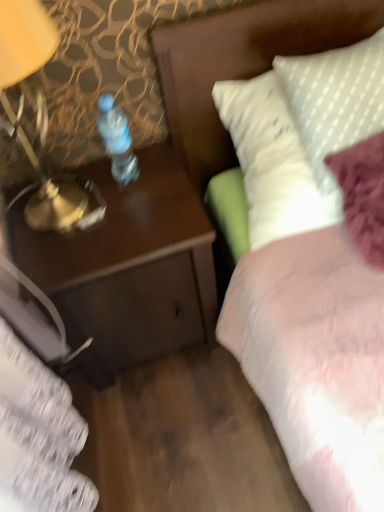
Question: Can you confirm if white dotted fabric at upper right is bigger than brown wood desk at left?

Choices:
 (A) no
 (B) yes

Answer: (A)

Question: Is white dotted fabric at upper right thinner than brown wood desk at left?

Choices:
 (A) no
 (B) yes

Answer: (A)

Question: Are white dotted fabric at upper right and brown wood desk at left located far from each other?

Choices:
 (A) yes
 (B) no

Answer: (B)

Question: From a real-world perspective, does white dotted fabric at upper right sit lower than brown wood desk at left?

Choices:
 (A) yes
 (B) no

Answer: (B)

Question: Considering the relative positions of white dotted fabric at upper right and brown wood desk at left in the image provided, is white dotted fabric at upper right to the left of brown wood desk at left from the viewer's perspective?

Choices:
 (A) yes
 (B) no

Answer: (B)

Question: Is brown wood desk at left located within white dotted fabric at upper right?

Choices:
 (A) no
 (B) yes

Answer: (A)

Question: From a real-world perspective, is white dotted fabric at upper right physically below clear plastic bottle at center?

Choices:
 (A) yes
 (B) no

Answer: (A)

Question: Does white dotted fabric at upper right have a lesser height compared to clear plastic bottle at center?

Choices:
 (A) yes
 (B) no

Answer: (B)

Question: Considering the relative sizes of white dotted fabric at upper right and clear plastic bottle at center in the image provided, is white dotted fabric at upper right bigger than clear plastic bottle at center?

Choices:
 (A) yes
 (B) no

Answer: (A)

Question: Can you confirm if white dotted fabric at upper right is positioned to the right of clear plastic bottle at center?

Choices:
 (A) yes
 (B) no

Answer: (A)

Question: From the image's perspective, is white dotted fabric at upper right beneath clear plastic bottle at center?

Choices:
 (A) no
 (B) yes

Answer: (A)

Question: Does white dotted fabric at upper right lie in front of clear plastic bottle at center?

Choices:
 (A) no
 (B) yes

Answer: (B)

Question: Does clear plastic bottle at center have a smaller size compared to white dotted fabric at upper right?

Choices:
 (A) yes
 (B) no

Answer: (A)